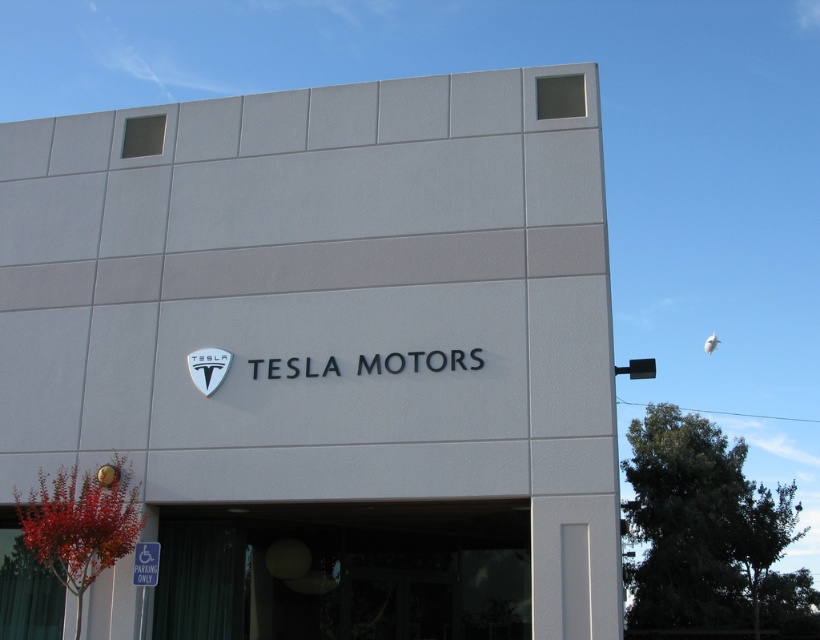
Question: Among these objects, which one is farthest from the camera?

Choices:
 (A) transparent glass door at lower center
 (B) white matte sign at center

Answer: (B)

Question: Is the position of white matte sign at center less distant than that of transparent glass door at lower center?

Choices:
 (A) yes
 (B) no

Answer: (B)

Question: Which of the following is the farthest from the observer?

Choices:
 (A) (301, 572)
 (B) (536, 125)

Answer: (A)

Question: Where is white matte sign at center located in relation to transparent glass door at lower center in the image?

Choices:
 (A) left
 (B) right

Answer: (A)

Question: Is white matte sign at center closer to camera compared to transparent glass door at lower center?

Choices:
 (A) no
 (B) yes

Answer: (A)